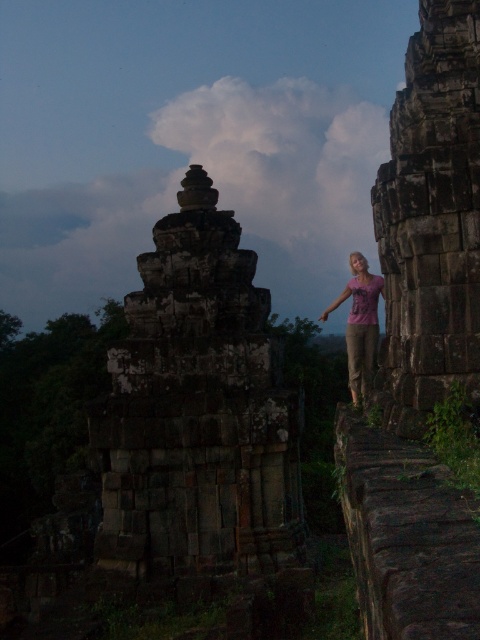
Does dark stone ruins at center have a greater width compared to purple cotton shirt at center-right?

In fact, dark stone ruins at center might be narrower than purple cotton shirt at center-right.

Does point (134, 460) come closer to viewer compared to point (367, 304)?

No, (134, 460) is behind (367, 304).

Locate an element on the screen. The width and height of the screenshot is (480, 640). dark stone ruins at center is located at coordinates (196, 413).